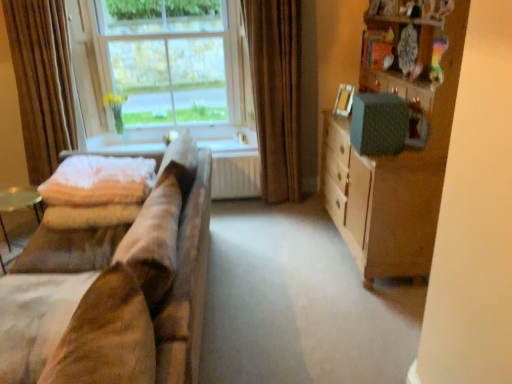
Question: Can you confirm if wooden cabinet at right is thinner than soft pink quilt at left?

Choices:
 (A) yes
 (B) no

Answer: (A)

Question: Is soft pink quilt at left at the back of wooden cabinet at right?

Choices:
 (A) no
 (B) yes

Answer: (A)

Question: Is wooden cabinet at right shorter than soft pink quilt at left?

Choices:
 (A) no
 (B) yes

Answer: (A)

Question: Is wooden cabinet at right bigger than soft pink quilt at left?

Choices:
 (A) no
 (B) yes

Answer: (B)

Question: From the image's perspective, is wooden cabinet at right on top of soft pink quilt at left?

Choices:
 (A) yes
 (B) no

Answer: (A)

Question: Is beige fabric curtain at left, acting as the first curtain starting from the left, taller or shorter than brown velvet curtain at center, arranged as the 2th curtain when viewed from the left?

Choices:
 (A) tall
 (B) short

Answer: (B)

Question: In terms of width, does beige fabric curtain at left, acting as the first curtain starting from the left, look wider or thinner when compared to brown velvet curtain at center, arranged as the 2th curtain when viewed from the left?

Choices:
 (A) wide
 (B) thin

Answer: (B)

Question: From a real-world perspective, is beige fabric curtain at left, the second curtain when ordered from right to left, physically located above or below brown velvet curtain at center, which ranks as the 1th curtain in right-to-left order?

Choices:
 (A) below
 (B) above

Answer: (B)

Question: Considering the positions of beige fabric curtain at left, acting as the first curtain starting from the left, and brown velvet curtain at center, arranged as the 2th curtain when viewed from the left, in the image, is beige fabric curtain at left, acting as the first curtain starting from the left, bigger or smaller than brown velvet curtain at center, arranged as the 2th curtain when viewed from the left,?

Choices:
 (A) big
 (B) small

Answer: (B)

Question: Considering the positions of clear glass window at upper left and brown velvet curtain at center, which ranks as the 1th curtain in right-to-left order, in the image, is clear glass window at upper left taller or shorter than brown velvet curtain at center, which ranks as the 1th curtain in right-to-left order,?

Choices:
 (A) short
 (B) tall

Answer: (A)

Question: From a real-world perspective, is clear glass window at upper left positioned above or below brown velvet curtain at center, arranged as the 2th curtain when viewed from the left?

Choices:
 (A) above
 (B) below

Answer: (A)

Question: Looking at the image, does clear glass window at upper left seem bigger or smaller compared to brown velvet curtain at center, arranged as the 2th curtain when viewed from the left?

Choices:
 (A) big
 (B) small

Answer: (B)

Question: Would you say clear glass window at upper left is inside or outside brown velvet curtain at center, which ranks as the 1th curtain in right-to-left order?

Choices:
 (A) inside
 (B) outside

Answer: (B)

Question: In terms of size, does clear glass window at upper left appear bigger or smaller than white fabric at lower left?

Choices:
 (A) big
 (B) small

Answer: (A)

Question: From the image's perspective, is clear glass window at upper left located above or below white fabric at lower left?

Choices:
 (A) below
 (B) above

Answer: (B)